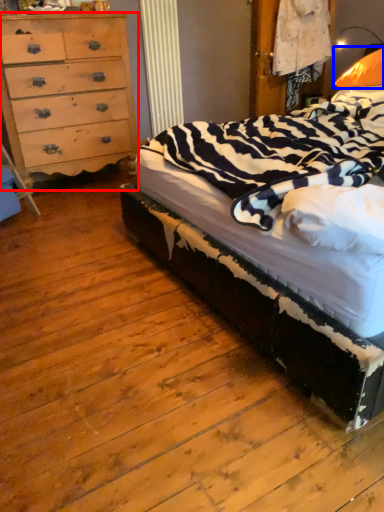
Question: Which point is closer to the camera, chest of drawers (highlighted by a red box) or pillow (highlighted by a blue box)?

Choices:
 (A) chest of drawers
 (B) pillow

Answer: (B)